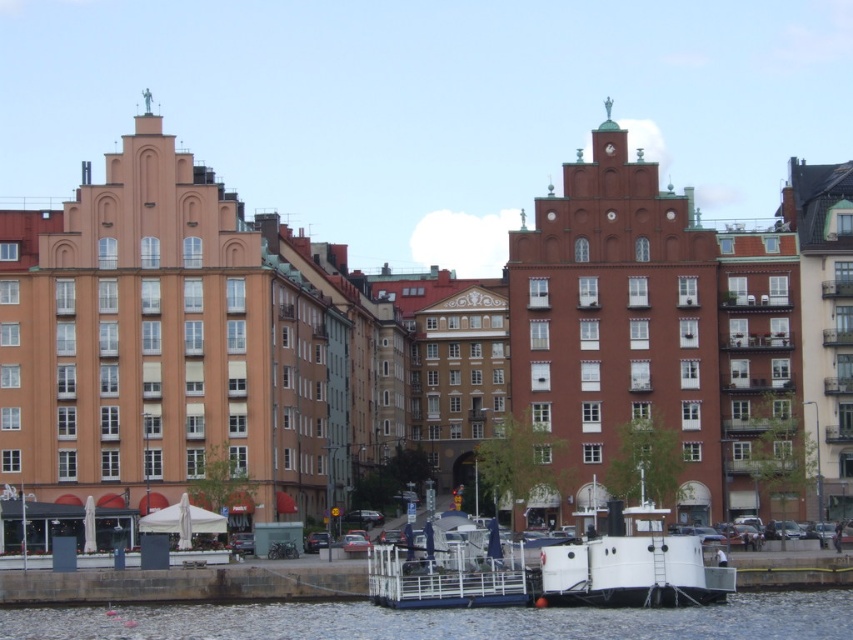
Which is below, white glossy water at lower center or white matte boat at lower center?

white glossy water at lower center

Does white glossy water at lower center appear on the left side of white matte boat at lower center?

No, white glossy water at lower center is not to the left of white matte boat at lower center.

This screenshot has width=853, height=640. What do you see at coordinates (444, 620) in the screenshot?
I see `white glossy water at lower center` at bounding box center [444, 620].

Where is `white glossy water at lower center`? The image size is (853, 640). white glossy water at lower center is located at coordinates (444, 620).